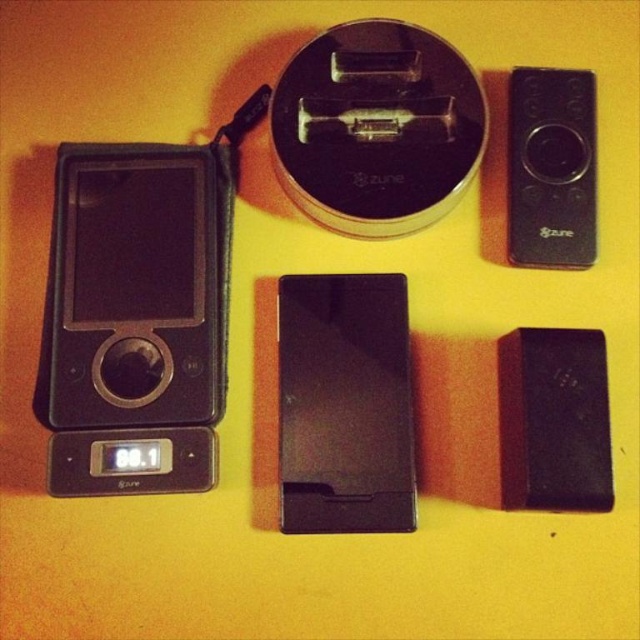
Question: Can you confirm if black matte ipod at center is thinner than black matte remote control at upper right?

Choices:
 (A) yes
 (B) no

Answer: (B)

Question: Which point appears farthest from the camera in this image?

Choices:
 (A) (97, 257)
 (B) (308, 307)
 (C) (582, 109)

Answer: (B)

Question: Which is farther from the black matte ipod at center?

Choices:
 (A) black matte remote control at upper right
 (B) matte black ipod at left

Answer: (A)

Question: Which object is closer to the camera taking this photo?

Choices:
 (A) black matte remote control at upper right
 (B) matte black ipod at left

Answer: (B)

Question: Can you confirm if black matte ipod at center is positioned below black matte remote control at upper right?

Choices:
 (A) no
 (B) yes

Answer: (B)

Question: Can you confirm if matte black ipod at left is smaller than black matte ipod at center?

Choices:
 (A) yes
 (B) no

Answer: (B)